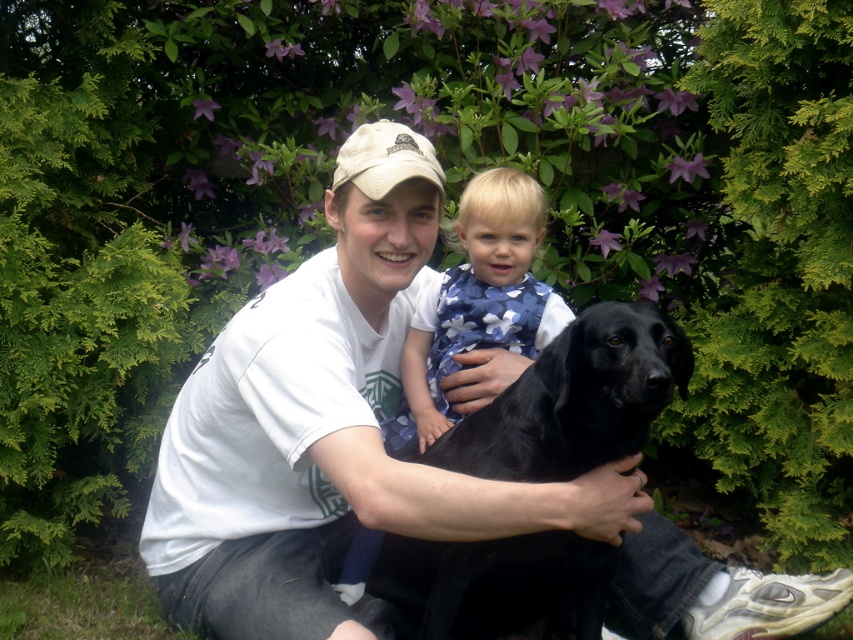
You are a photographer trying to capture a clear shot of the beige fabric cap at center. However, the shiny black dog at center is blocking your view. Can you adjust your position to see the cap without moving the dog?

The shiny black dog at center is in front of the beige fabric cap at center, so you need to move around the dog to get a clear view of the cap.

You are a photographer trying to capture a candid shot of the blue floral dress at center and the matte black dog at center. Since you want to ensure both are in focus, you need to know their positions relative to each other. Which object is positioned to the left of the other?

The matte black dog at center is to the left of the blue floral dress at center.